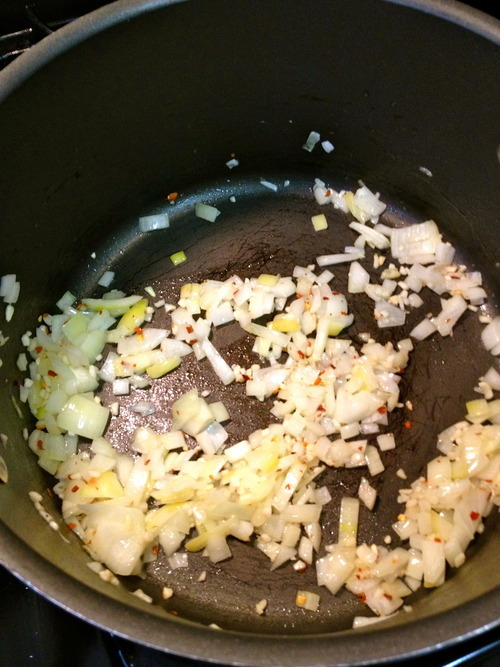
Find the location of `scratches on bottom of frying pan`. scratches on bottom of frying pan is located at coordinates (252, 257), (414, 442).